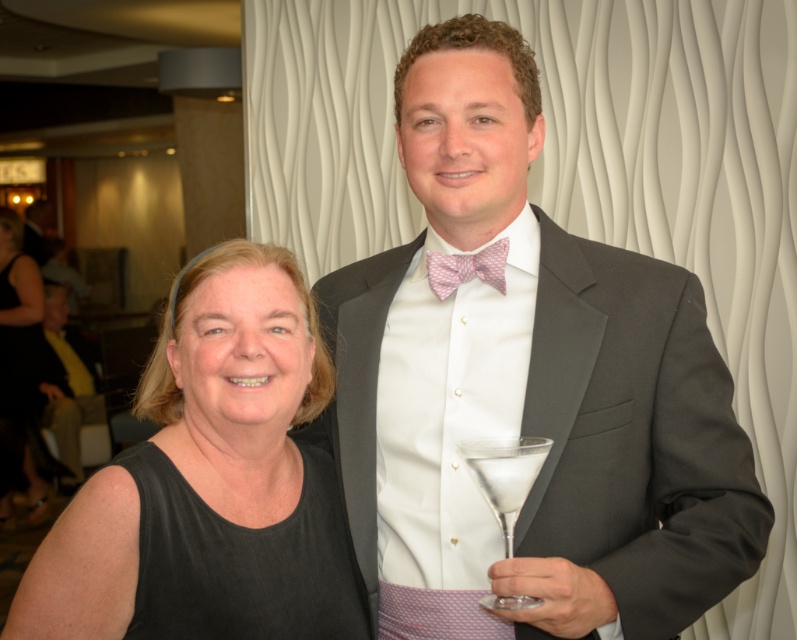
You are a photographer at this event and want to ensure both the matte gray suit at center and the clear glass martini glass at right are clearly visible in your photo. Considering their sizes, which object might require more careful framing to avoid being too small in the shot?

The clear glass martini glass at right is much smaller than the matte gray suit at center, so it might require more careful framing to ensure it isn not too small in the photo.

You are a photographer adjusting your camera settings. You notice two points in the image at coordinates point (x=664, y=468) and point (x=479, y=252). Which point is nearer to the camera lens?

Point (x=664, y=468) is closer to the camera lens than point (x=479, y=252).

What are the coordinates of the black fabric at left in the image?

The coordinates of the black fabric at left are at point [210,483].